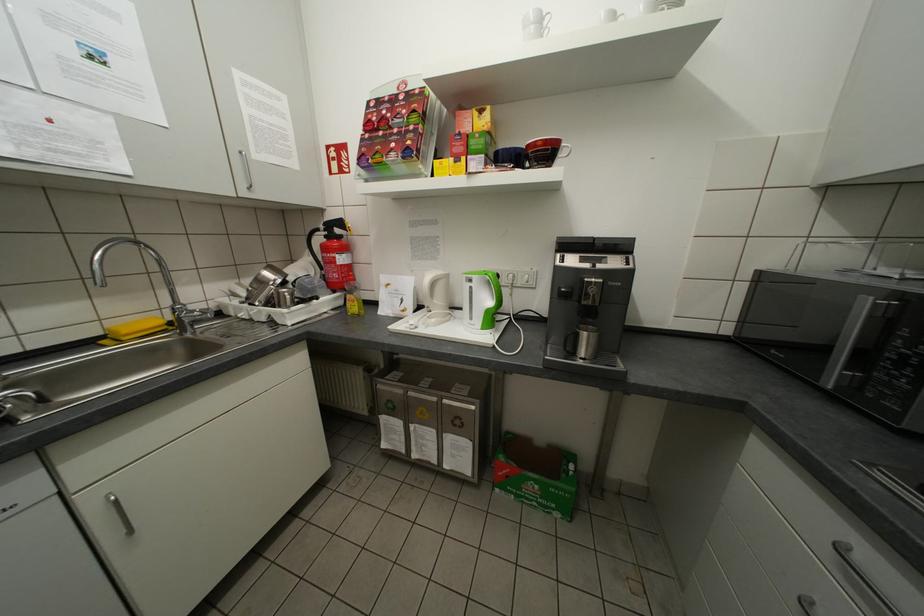
Find where to squeez the yellow soap bottle. Please return your answer as a coordinate pair (x, y).

(353, 297)